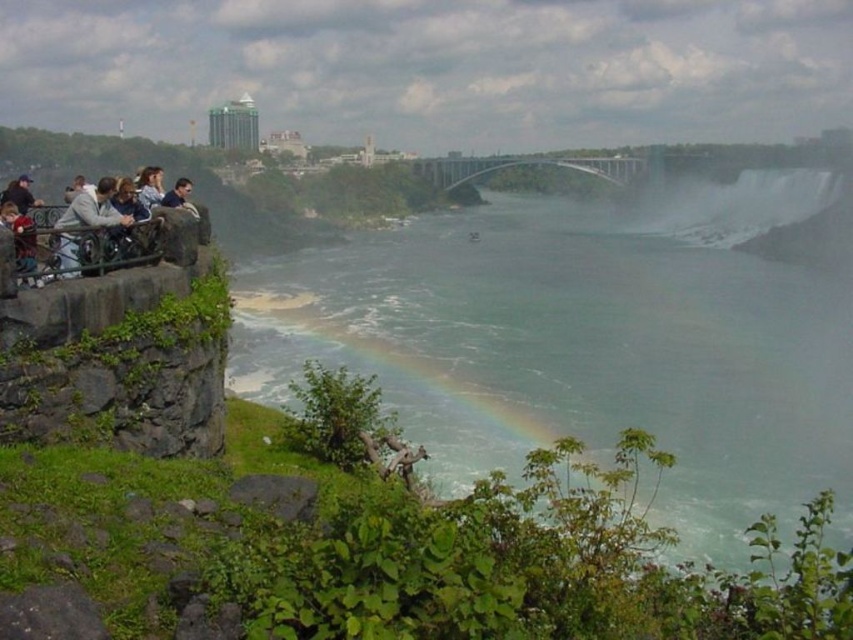
Question: Which of the following is the farthest from the observer?

Choices:
 (A) (769, 189)
 (B) (74, 262)

Answer: (A)

Question: Can you confirm if light gray concrete railing at left is wider than light brown leather jacket at left?

Choices:
 (A) no
 (B) yes

Answer: (A)

Question: Which point is farther to the camera?

Choices:
 (A) light gray concrete railing at left
 (B) translucent misty water at center
 (C) light brown leather jacket at left

Answer: (B)

Question: Can you confirm if translucent misty water at center is smaller than light brown leather jacket at left?

Choices:
 (A) no
 (B) yes

Answer: (A)

Question: Considering the relative positions of translucent misty water at center and light gray concrete railing at left in the image provided, where is translucent misty water at center located with respect to light gray concrete railing at left?

Choices:
 (A) left
 (B) right

Answer: (B)

Question: Based on their relative distances, which object is nearer to the light gray concrete railing at left?

Choices:
 (A) light brown leather jacket at left
 (B) translucent misty water at center

Answer: (A)